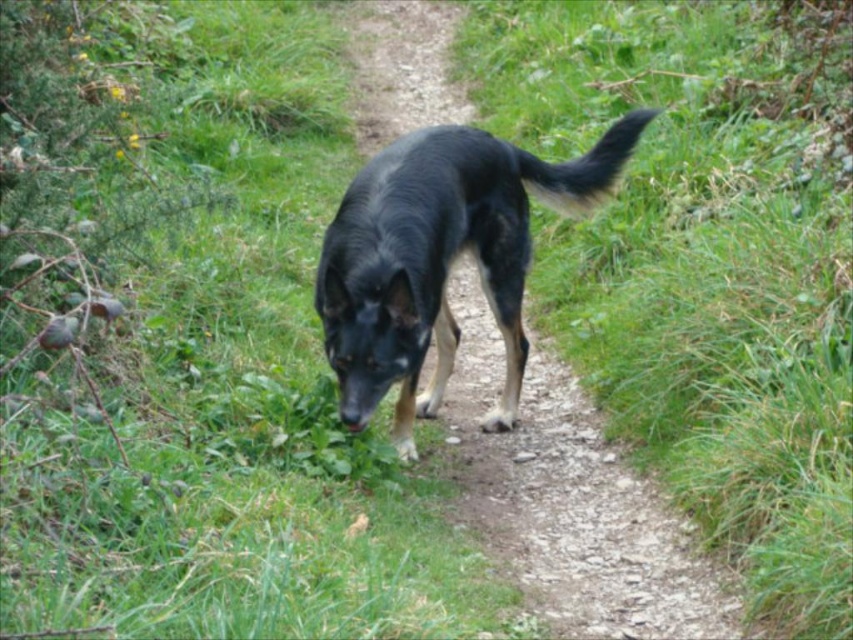
Looking at this image, you are a hiker trying to decide whether to walk on the path or the grass. Based on the scene, which area is wider, the green grassy at center or the shiny black fur at center?

The green grassy at center is wider than the shiny black fur at center according to the description.

You are a hiker who wants to follow the dog along the path. Which direction should you walk to stay on the path while avoiding the green grassy at center and the shiny black fur at center?

The green grassy at center is to the right of the shiny black fur at center. To stay on the path, walk to the left side of the shiny black fur at center to avoid both the grass and the dog.

You are standing on the path and want to reach the point marked at coordinates (762, 324). Given that the path is narrow and surrounded by grass, can you estimate how far you need to walk to reach that point?

The point marked at coordinates (762, 324) is 12.95 feet away from the viewer, so you need to walk approximately 12.95 feet to reach it.